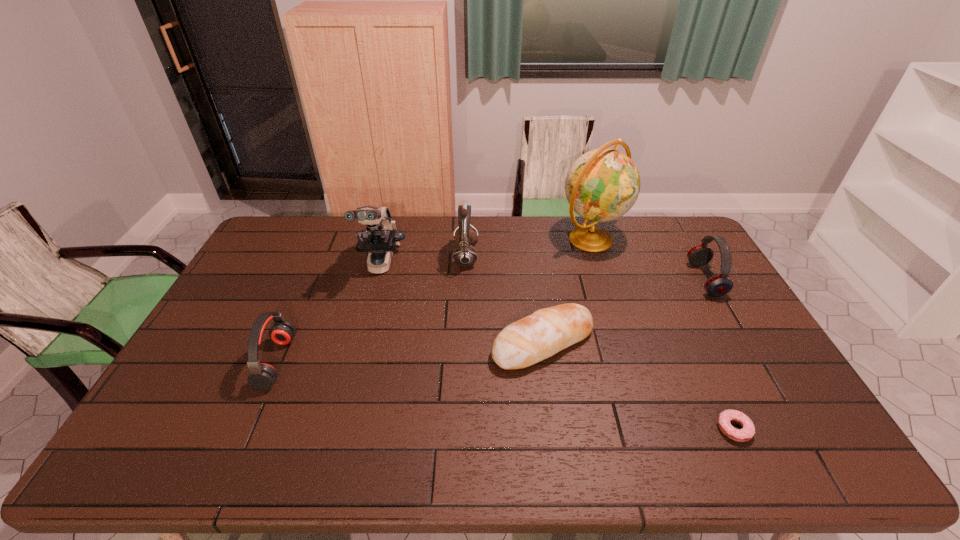
The image size is (960, 540). I want to click on the second object from right to left, so click(745, 434).

Identify the location of free region located 0.190m on the right of the globe. This screenshot has height=540, width=960. (674, 238).

This screenshot has height=540, width=960. I want to click on free spot located 0.160m through the eyepieces of the sixth object from right to left, so click(x=365, y=324).

Image resolution: width=960 pixels, height=540 pixels. Identify the location of vacant space situated 0.120m on the ear pads of the third object from left to right. (512, 257).

The image size is (960, 540). What are the coordinates of `vacant space located 0.290m on the ear cups of the rightmost earphone` in the screenshot? It's located at (609, 280).

You are a GUI agent. You are given a task and a screenshot of the screen. Output one action in this format:
    pyautogui.click(x=<x>, y=<y>)
    Task: Click on the vacant space situated on the ear cups of the rightmost earphone
    This screenshot has height=540, width=960.
    Given the screenshot: What is the action you would take?
    pyautogui.click(x=585, y=280)

Locate an element on the screen. The height and width of the screenshot is (540, 960). free spot located 0.230m on the ear cups of the rightmost earphone is located at coordinates (626, 280).

Locate an element on the screen. free region located on the ear cups of the nearest earphone is located at coordinates (309, 362).

Find the location of a particular element. The width and height of the screenshot is (960, 540). free region located 0.400m on the left of the bread is located at coordinates [355, 342].

Identify the location of free space located 0.270m on the back of the nearest object. The width and height of the screenshot is (960, 540). (689, 334).